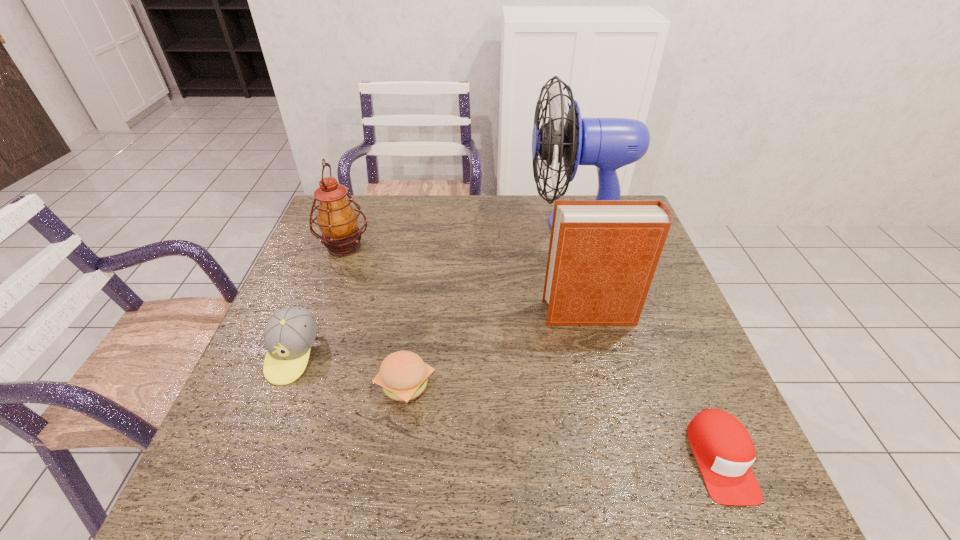
Where is `the tallest object`? The width and height of the screenshot is (960, 540). the tallest object is located at coordinates (608, 143).

Identify the location of hardback book. (603, 254).

The image size is (960, 540). I want to click on oil lamp, so click(337, 220).

Image resolution: width=960 pixels, height=540 pixels. Find the location of `the farther baseball cap`. the farther baseball cap is located at coordinates (290, 332).

This screenshot has width=960, height=540. In order to click on the fourth tallest object in this screenshot , I will do `click(290, 332)`.

The image size is (960, 540). Find the location of `the fourth object from right to left`. the fourth object from right to left is located at coordinates click(403, 376).

Identify the location of the nearest object. (724, 451).

Identify the location of the shorter baseball cap. (724, 451).

I want to click on vacant region located in front of the tallest object where the airflow is directed, so click(x=458, y=224).

At what (x,y) coordinates should I click in order to perform the action: click on vacant region located 0.390m in front of the tallest object where the airflow is directed. Please return your answer as a coordinate pair (x, y). This screenshot has width=960, height=540. Looking at the image, I should click on (405, 224).